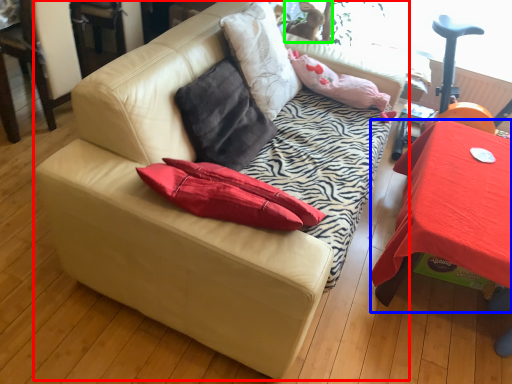
Question: Based on their relative distances, which object is nearer to studio couch (highlighted by a red box)? Choose from table (highlighted by a blue box) and animal (highlighted by a green box).

Choices:
 (A) table
 (B) animal

Answer: (A)